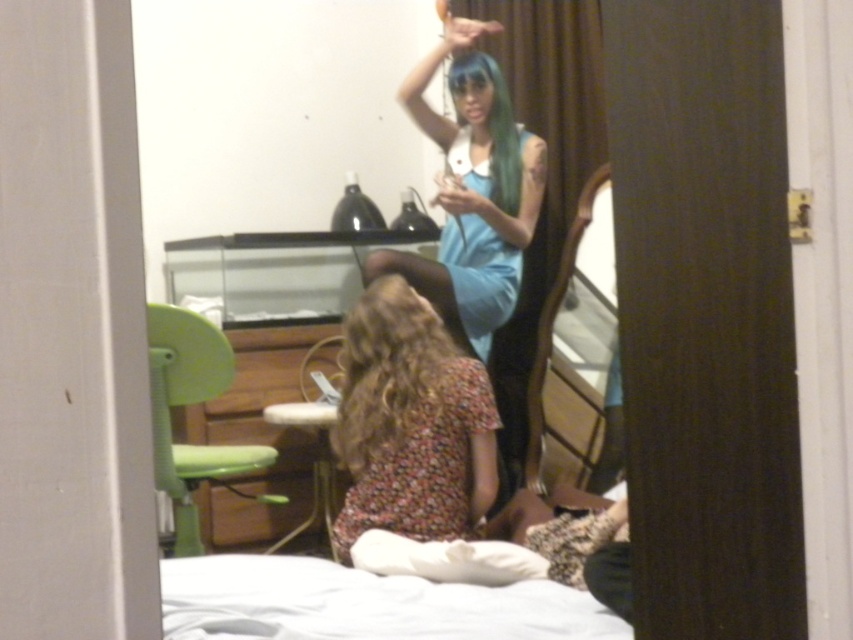
You are standing in the doorway looking into the room. You see the curly brown hair at lower center and the blue silky hair at upper center. Which one is closer to you?

The curly brown hair at lower center is closer to you because it is located below the blue silky hair at upper center, meaning it is positioned nearer in the room.

In the scene shown: You are organizing a small party and need to place a 1.2 meter wide tablecloth on either the floral fabric dress at center or the wooden mirror at center. Which object can the tablecloth fit over without hanging off the sides?

The floral fabric dress at center has a greater width than the wooden mirror at center, so the tablecloth would fit better on the floral fabric dress at center since it is wider.